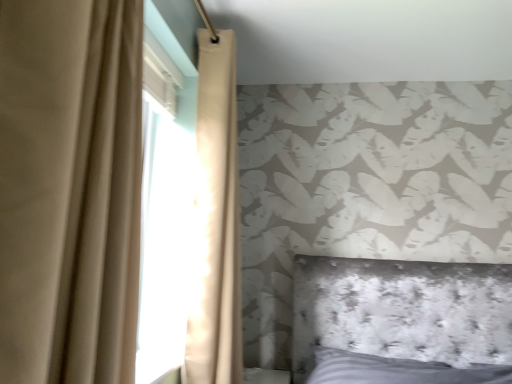
Question: Is beige fabric curtain at left, which appears as the 1th curtain when viewed from the front, completely or partially outside of beige fabric curtain at upper left, which is the 2th curtain in front-to-back order?

Choices:
 (A) no
 (B) yes

Answer: (B)

Question: Is beige fabric curtain at upper left, which is the 2th curtain in front-to-back order, at the back of beige fabric curtain at left, placed as the 2th curtain when sorted from back to front?

Choices:
 (A) yes
 (B) no

Answer: (B)

Question: Is beige fabric curtain at left, placed as the 2th curtain when sorted from back to front, at the left side of beige fabric curtain at upper left, which is the 2th curtain in front-to-back order?

Choices:
 (A) yes
 (B) no

Answer: (A)

Question: Can you confirm if beige fabric curtain at left, placed as the 2th curtain when sorted from back to front, is bigger than beige fabric curtain at upper left, which is the 2th curtain in front-to-back order?

Choices:
 (A) no
 (B) yes

Answer: (A)

Question: Is beige fabric curtain at upper left, acting as the first curtain starting from the back, surrounded by beige fabric curtain at left, placed as the 2th curtain when sorted from back to front?

Choices:
 (A) yes
 (B) no

Answer: (B)

Question: From a real-world perspective, does beige fabric curtain at left, placed as the 2th curtain when sorted from back to front, sit lower than beige fabric curtain at upper left, acting as the first curtain starting from the back?

Choices:
 (A) yes
 (B) no

Answer: (A)

Question: Is beige fabric curtain at upper left, acting as the first curtain starting from the back, beside beige fabric curtain at left, placed as the 2th curtain when sorted from back to front?

Choices:
 (A) no
 (B) yes

Answer: (A)

Question: Is beige fabric curtain at upper left, acting as the first curtain starting from the back, turned away from beige fabric curtain at left, placed as the 2th curtain when sorted from back to front?

Choices:
 (A) no
 (B) yes

Answer: (A)

Question: Is beige fabric curtain at upper left, acting as the first curtain starting from the back, oriented towards beige fabric curtain at left, which appears as the 1th curtain when viewed from the front?

Choices:
 (A) no
 (B) yes

Answer: (A)

Question: Does beige fabric curtain at upper left, acting as the first curtain starting from the back, come in front of beige fabric curtain at left, placed as the 2th curtain when sorted from back to front?

Choices:
 (A) yes
 (B) no

Answer: (B)

Question: Can you confirm if beige fabric curtain at upper left, acting as the first curtain starting from the back, is positioned to the left of beige fabric curtain at left, which appears as the 1th curtain when viewed from the front?

Choices:
 (A) no
 (B) yes

Answer: (A)

Question: From the image's perspective, is beige fabric curtain at upper left, acting as the first curtain starting from the back, on beige fabric curtain at left, which appears as the 1th curtain when viewed from the front?

Choices:
 (A) no
 (B) yes

Answer: (A)

Question: Considering their positions, is beige fabric curtain at upper left, which is the 2th curtain in front-to-back order, located in front of or behind beige fabric curtain at left, placed as the 2th curtain when sorted from back to front?

Choices:
 (A) front
 (B) behind

Answer: (B)